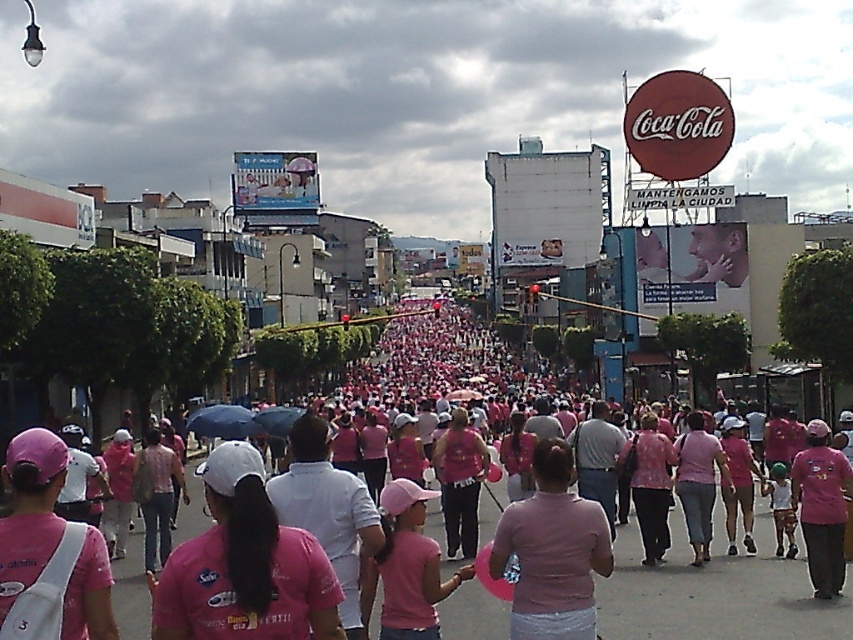
Question: Among these objects, which one is farthest from the camera?

Choices:
 (A) matte pink shirt at center
 (B) transparent plastic umbrella at center

Answer: (B)

Question: Does pink matte shirt at center appear on the left side of blue matte umbrella at center?

Choices:
 (A) yes
 (B) no

Answer: (B)

Question: Is pink fabric shirt at center above pink matte shirt at center?

Choices:
 (A) no
 (B) yes

Answer: (A)

Question: Among these objects, which one is farthest from the camera?

Choices:
 (A) transparent plastic umbrella at center
 (B) pink fabric shirts at center
 (C) pink matte shirt at center
 (D) blue matte umbrella at center

Answer: (D)

Question: Which point is farther from the camera taking this photo?

Choices:
 (A) (468, 326)
 (B) (381, 493)

Answer: (A)

Question: Observing the image, what is the correct spatial positioning of pink fabric shirts at center in reference to pink matte shirt at center?

Choices:
 (A) right
 (B) left

Answer: (B)